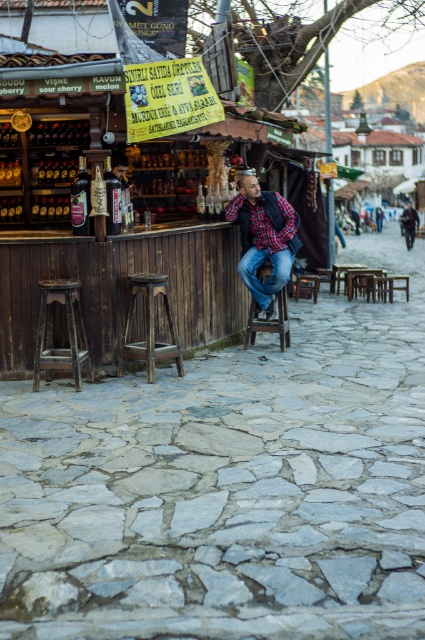
Question: Which of the following is the closest to the observer?

Choices:
 (A) wooden at center
 (B) plaid shirt at center
 (C) wooden bar stool at lower left

Answer: (C)

Question: Which point is closer to the camera?

Choices:
 (A) click(x=277, y=317)
 (B) click(x=79, y=352)
 (C) click(x=299, y=276)
 (D) click(x=402, y=225)

Answer: (B)

Question: Can you confirm if plaid shirt at center is wider than dark blue jeans at center?

Choices:
 (A) yes
 (B) no

Answer: (B)

Question: Considering the relative positions of wooden bar stool at center and dark blue jeans at center in the image provided, where is wooden bar stool at center located with respect to dark blue jeans at center?

Choices:
 (A) left
 (B) right

Answer: (A)

Question: Does wooden bar at center have a larger size compared to plaid shirt at center?

Choices:
 (A) no
 (B) yes

Answer: (B)

Question: Which of the following is the closest to the observer?

Choices:
 (A) wooden bar stool at lower left
 (B) wooden at center
 (C) plaid shirt at center
 (D) wooden bar stool at center

Answer: (A)